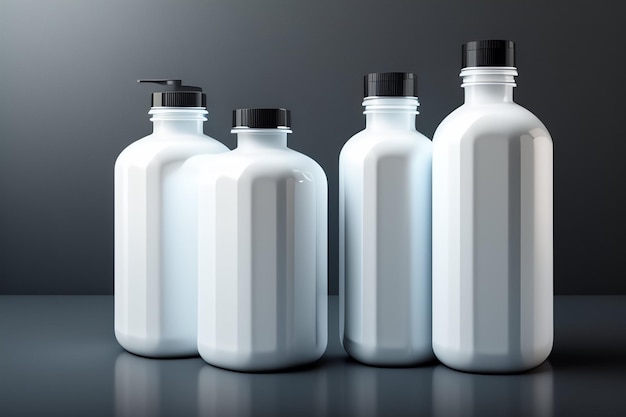
You are a GUI agent. You are given a task and a screenshot of the screen. Output one action in this format:
    pyautogui.click(x=<x>, y=<y>)
    Task: Click on the four white plastic containers with black caps
    
    Given the screenshot: What is the action you would take?
    pyautogui.click(x=155, y=200), pyautogui.click(x=240, y=223), pyautogui.click(x=372, y=213), pyautogui.click(x=481, y=213)